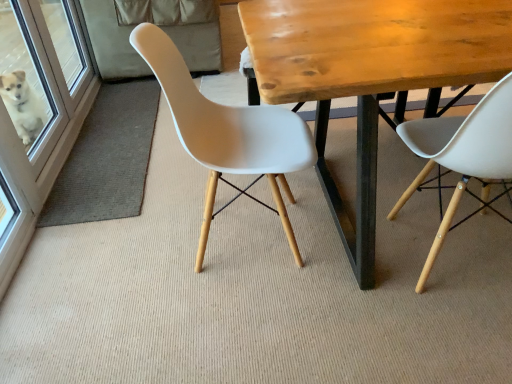
Locate an element on the screen. This screenshot has height=384, width=512. vacant area situated to the left side of wooden table at center is located at coordinates (152, 267).